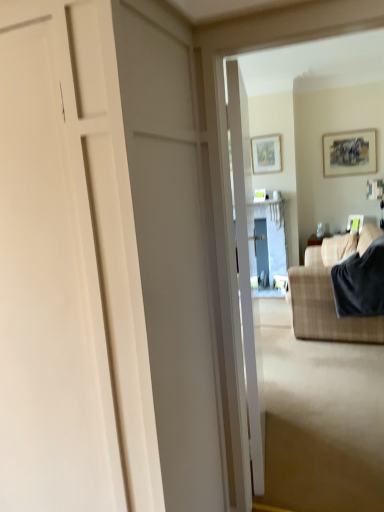
I want to click on white glossy door at center, which ranks as the 2th door in left-to-right order, so click(246, 267).

Find the location of a particular element. The image size is (384, 512). dark gray fabric at right is located at coordinates (360, 282).

Describe the element at coordinates (360, 282) in the screenshot. I see `dark gray fabric at right` at that location.

Describe the element at coordinates (69, 271) in the screenshot. I see `white matte door at center, the 1th door in the left-to-right sequence` at that location.

Where is `white glossy door at center, which is the 1th door from right to left`? The height and width of the screenshot is (512, 384). white glossy door at center, which is the 1th door from right to left is located at coordinates click(246, 267).

Is dark gray fabric at right behind matte white picture frame at upper right, the 1th picture frame viewed from the right?

That is False.

Does point (348, 282) appear closer or farther from the camera than point (353, 222)?

Point (348, 282) is positioned closer to the camera compared to point (353, 222).

From the image's perspective, relative to matte white picture frame at upper right, which is the first picture frame in bottom-to-top order, is dark gray fabric at right above or below?

dark gray fabric at right is situated lower than matte white picture frame at upper right, which is the first picture frame in bottom-to-top order, in the image.

Between matte white picture frame at upper right, acting as the 3th picture frame starting from the left, and matte wooden picture frame at upper right, which appears as the second picture frame when viewed from the left, which one appears on the left side from the viewer's perspective?

From the viewer's perspective, matte wooden picture frame at upper right, which appears as the second picture frame when viewed from the left, appears more on the left side.

Is matte white picture frame at upper right, acting as the 3th picture frame starting from the left, looking in the opposite direction of matte wooden picture frame at upper right, the 2th picture frame when ordered from bottom to top?

No, matte white picture frame at upper right, acting as the 3th picture frame starting from the left,'s orientation is not away from matte wooden picture frame at upper right, the 2th picture frame when ordered from bottom to top.

Is matte white picture frame at upper right, positioned as the third picture frame in top-to-bottom order, not within matte wooden picture frame at upper right, the 2th picture frame when ordered from right to left?

Yes, matte white picture frame at upper right, positioned as the third picture frame in top-to-bottom order, is not within matte wooden picture frame at upper right, the 2th picture frame when ordered from right to left.

Which of these two, matte wooden picture frame at upper center, which appears as the 3th picture frame when ordered from the bottom, or dark gray fabric at right, stands taller?

With more height is dark gray fabric at right.

Does matte wooden picture frame at upper center, acting as the 3th picture frame starting from the right, have a larger size compared to dark gray fabric at right?

No.

Consider the image. Considering the relative sizes of matte white picture frame at upper right, acting as the 3th picture frame starting from the left, and white glossy door at center, which ranks as the 2th door in left-to-right order, in the image provided, is matte white picture frame at upper right, acting as the 3th picture frame starting from the left, shorter than white glossy door at center, which ranks as the 2th door in left-to-right order,?

Yes, matte white picture frame at upper right, acting as the 3th picture frame starting from the left, is shorter than white glossy door at center, which ranks as the 2th door in left-to-right order.

From a real-world perspective, who is located lower, matte white picture frame at upper right, the 1th picture frame viewed from the right, or white glossy door at center, which ranks as the 2th door in left-to-right order?

In real-world perspective, matte white picture frame at upper right, the 1th picture frame viewed from the right, is lower.

Is matte white picture frame at upper right, which is the first picture frame in bottom-to-top order, aimed at white glossy door at center, which ranks as the 2th door in left-to-right order?

Yes, matte white picture frame at upper right, which is the first picture frame in bottom-to-top order, is facing white glossy door at center, which ranks as the 2th door in left-to-right order.

Is point (349, 217) closer to camera compared to point (235, 129)?

That is False.

In the image, is white matte door at center, the 1th door in the left-to-right sequence, on the left side or the right side of matte wooden picture frame at upper center, which appears as the 3th picture frame when ordered from the bottom?

Based on their positions, white matte door at center, the 1th door in the left-to-right sequence, is located to the left of matte wooden picture frame at upper center, which appears as the 3th picture frame when ordered from the bottom.

Does white matte door at center, the 2th door from the right, have a greater height compared to matte wooden picture frame at upper center, marked as the first picture frame in a top-to-bottom arrangement?

Indeed, white matte door at center, the 2th door from the right, has a greater height compared to matte wooden picture frame at upper center, marked as the first picture frame in a top-to-bottom arrangement.

Which is behind, point (99, 245) or point (269, 153)?

Positioned behind is point (269, 153).

Can matte wooden picture frame at upper center, the 1th picture frame in the left-to-right sequence, be found inside white matte door at center, the 1th door in the left-to-right sequence?

No, matte wooden picture frame at upper center, the 1th picture frame in the left-to-right sequence, is not a part of white matte door at center, the 1th door in the left-to-right sequence.

Is white matte door at center, the 2th door from the right, positioned with its back to white glossy door at center, which ranks as the 2th door in left-to-right order?

No, white matte door at center, the 2th door from the right, is not facing the opposite direction of white glossy door at center, which ranks as the 2th door in left-to-right order.

Is the position of white matte door at center, the 1th door in the left-to-right sequence, less distant than that of white glossy door at center, which is the 1th door from right to left?

That is True.

Is white matte door at center, the 1th door in the left-to-right sequence, shorter than white glossy door at center, which is the 1th door from right to left?

No, white matte door at center, the 1th door in the left-to-right sequence, is not shorter than white glossy door at center, which is the 1th door from right to left.

From a real-world perspective, does white matte door at center, the 2th door from the right, stand above white glossy door at center, which is the 1th door from right to left?

Yes, from a real-world perspective, white matte door at center, the 2th door from the right, is above white glossy door at center, which is the 1th door from right to left.

Based on their sizes in the image, would you say white glossy door at center, which ranks as the 2th door in left-to-right order, is bigger or smaller than dark gray fabric at right?

Clearly, white glossy door at center, which ranks as the 2th door in left-to-right order, is larger in size than dark gray fabric at right.

Is white glossy door at center, which is the 1th door from right to left, aimed at dark gray fabric at right?

No, white glossy door at center, which is the 1th door from right to left, is not oriented towards dark gray fabric at right.

Which is behind, point (245, 350) or point (362, 308)?

The point (362, 308) is more distant.

How many degrees apart are the facing directions of white glossy door at center, which ranks as the 2th door in left-to-right order, and dark gray fabric at right?

There is a 168-degree angle between the facing directions of white glossy door at center, which ranks as the 2th door in left-to-right order, and dark gray fabric at right.

From the image's perspective, count 1st picture frames upward from the dark gray fabric at right and point to it. Please provide its 2D coordinates.

[(355, 223)]

This screenshot has width=384, height=512. Find the location of `the 1st picture frame to the left of the matte white picture frame at upper right, positioned as the third picture frame in top-to-bottom order, starting your count from the anchor`. the 1st picture frame to the left of the matte white picture frame at upper right, positioned as the third picture frame in top-to-bottom order, starting your count from the anchor is located at coordinates (349, 153).

Estimate the real-world distances between objects in this image. Which object is closer to white matte door at center, the 1th door in the left-to-right sequence, white glossy door at center, which is the 1th door from right to left, or matte wooden picture frame at upper center, acting as the 3th picture frame starting from the right?

Among the two, white glossy door at center, which is the 1th door from right to left, is located nearer to white matte door at center, the 1th door in the left-to-right sequence.

Which object lies nearer to the anchor point white glossy door at center, which is the 1th door from right to left, white matte door at center, the 2th door from the right, or matte wooden picture frame at upper right, which appears as the second picture frame when viewed from the left?

Among the two, white matte door at center, the 2th door from the right, is located nearer to white glossy door at center, which is the 1th door from right to left.

When comparing their distances from plaid fabric couch at right, does matte white picture frame at upper right, the 1th picture frame viewed from the right, or dark gray fabric at right seem closer?

dark gray fabric at right is closer to plaid fabric couch at right.

Looking at this image, from the image, which object appears to be farther from white matte door at center, the 2th door from the right, matte wooden picture frame at upper center, acting as the 3th picture frame starting from the right, or white glossy door at center, which is the 1th door from right to left?

Among the two, matte wooden picture frame at upper center, acting as the 3th picture frame starting from the right, is located further to white matte door at center, the 2th door from the right.

Looking at this image, which object lies further to the anchor point white glossy door at center, which is the 1th door from right to left, white matte door at center, the 2th door from the right, or plaid fabric couch at right?

plaid fabric couch at right lies further to white glossy door at center, which is the 1th door from right to left, than the other object.

Consider the image. Looking at the image, which one is located further to matte white picture frame at upper right, which is the first picture frame in bottom-to-top order, matte wooden picture frame at upper center, acting as the 3th picture frame starting from the right, or matte wooden picture frame at upper right, the 2th picture frame when ordered from right to left?

matte wooden picture frame at upper center, acting as the 3th picture frame starting from the right, is positioned further to the anchor matte white picture frame at upper right, which is the first picture frame in bottom-to-top order.

In the scene shown: From the image, which object appears to be farther from white glossy door at center, which ranks as the 2th door in left-to-right order, dark gray fabric at right or matte white picture frame at upper right, acting as the 3th picture frame starting from the left?

Based on the image, matte white picture frame at upper right, acting as the 3th picture frame starting from the left, appears to be further to white glossy door at center, which ranks as the 2th door in left-to-right order.

Which object lies nearer to the anchor point dark gray fabric at right, matte wooden picture frame at upper right, which appears as the second picture frame when viewed from the left, or plaid fabric couch at right?

The object closer to dark gray fabric at right is plaid fabric couch at right.

The image size is (384, 512). I want to click on studio couch located between dark gray fabric at right and matte wooden picture frame at upper center, which appears as the 3th picture frame when ordered from the bottom, in the depth direction, so click(x=325, y=306).

At what (x,y) coordinates should I click in order to perform the action: click on blanket between white glossy door at center, which is the 1th door from right to left, and plaid fabric couch at right in the front-back direction. Please return your answer as a coordinate pair (x, y). Looking at the image, I should click on pos(360,282).

At what (x,y) coordinates should I click in order to perform the action: click on door between white matte door at center, the 1th door in the left-to-right sequence, and matte wooden picture frame at upper center, which appears as the 3th picture frame when ordered from the bottom, in the front-back direction. Please return your answer as a coordinate pair (x, y). The height and width of the screenshot is (512, 384). Looking at the image, I should click on (246, 267).

Find the location of `picture frame located between white matte door at center, the 1th door in the left-to-right sequence, and matte white picture frame at upper right, positioned as the third picture frame in top-to-bottom order, in the depth direction`. picture frame located between white matte door at center, the 1th door in the left-to-right sequence, and matte white picture frame at upper right, positioned as the third picture frame in top-to-bottom order, in the depth direction is located at coordinates (349, 153).